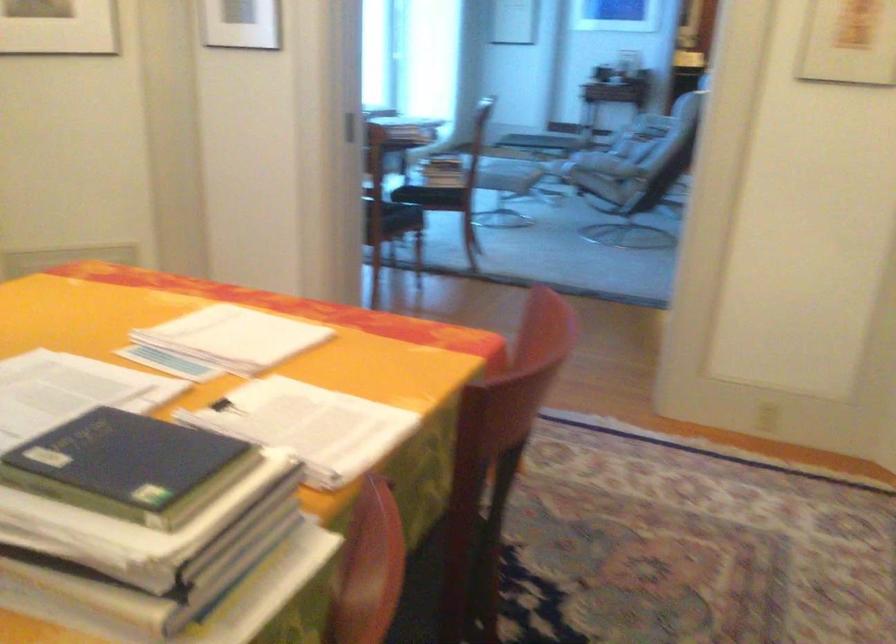
Locate an element on the screen. chair armrest is located at coordinates (604, 165).